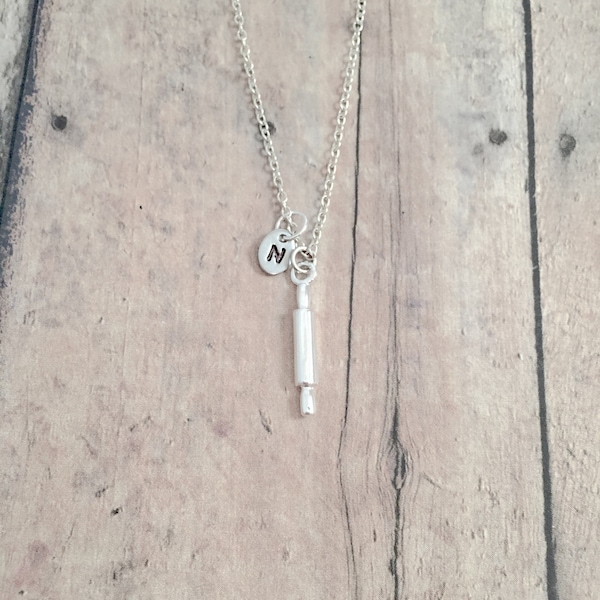
You are a GUI agent. You are given a task and a screenshot of the screen. Output one action in this format:
    pyautogui.click(x=<x>, y=<y>)
    Task: Click on the woosen surface
    
    Given the screenshot: What is the action you would take?
    (x=196, y=430)